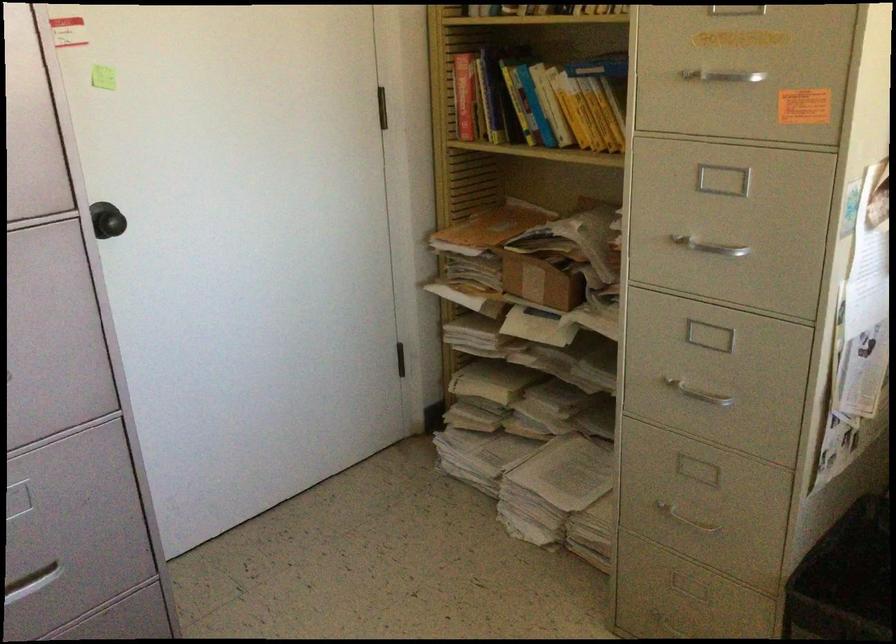
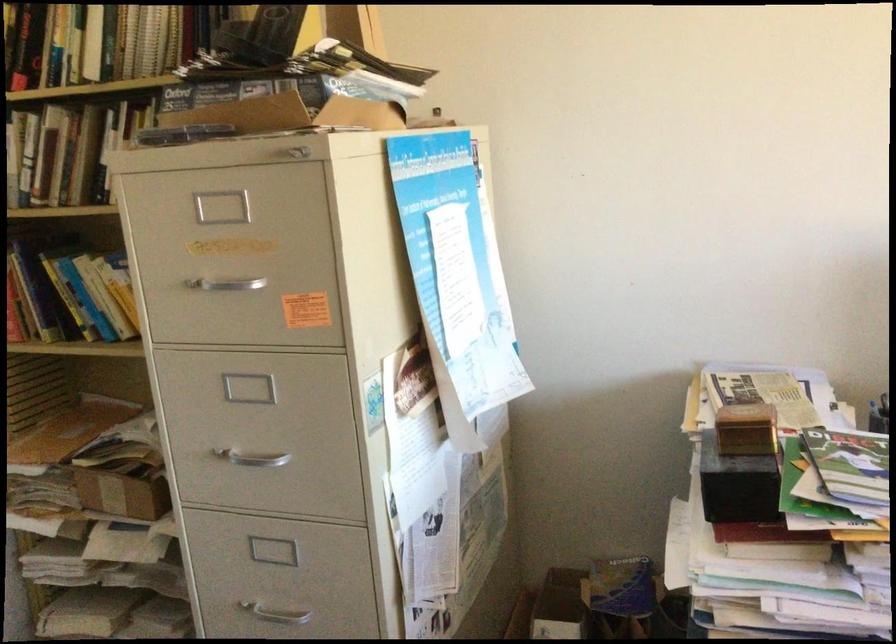
Question: The camera is either moving clockwise (left) or counter-clockwise (right) around the object. The first image is from the beginning of the video and the second image is from the end. Is the camera moving left or right when shooting the video?

Choices:
 (A) Left
 (B) Right

Answer: (A)